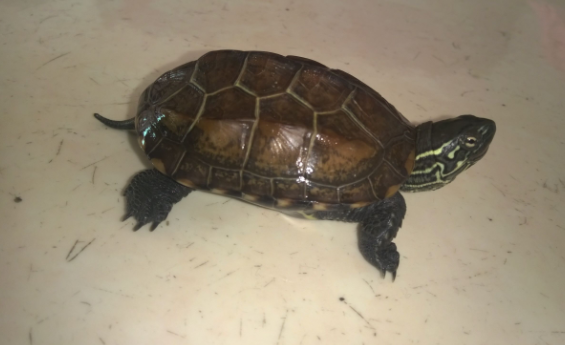
This screenshot has height=345, width=565. Identify the location of floor behind the turtois. (101, 166).